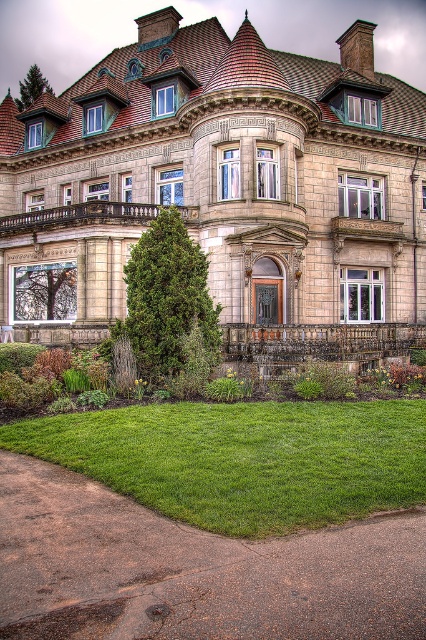
You are a landscape architect designing a garden for the beige stone mansion at center. The green lawn at lower center is part of the garden. Considering the size difference between the two, which area should you focus more on to ensure the garden looks balanced?

The beige stone mansion at center is bigger than the green lawn at lower center, so to ensure balance in the garden design, the landscape architect should focus more on expanding or enhancing the green lawn at lower center to match the mansion.

You are a landscape architect planning to install a new garden pathway between the beige stone mansion at center and the green lawn at lower center. The pathway requires a minimum of 15 meters of space. Can the existing distance accommodate this requirement?

The beige stone mansion at center and green lawn at lower center are 17.40 meters apart from each other, which exceeds the required 15 meters. Therefore, the existing distance can accommodate the new garden pathway.

You are standing in a park across from the beige stone mansion at center. You want to take a photo of it from a distance where it will appear half its actual size. If you are currently 22.74 meters away, how much farther should you move away to achieve this?

The beige stone mansion at center is currently 22.74 meters away. To make it appear half its actual size, you need to double the distance. Therefore, you should move an additional 22.74 meters, totaling 45.48 meters from the mansion.